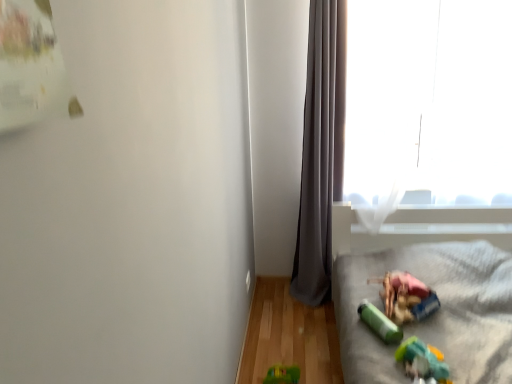
Question: Looking at the image, does transparent glass window at upper right seem bigger or smaller compared to plush gray blanket at lower right?

Choices:
 (A) small
 (B) big

Answer: (A)

Question: In terms of height, does transparent glass window at upper right look taller or shorter compared to plush gray blanket at lower right?

Choices:
 (A) short
 (B) tall

Answer: (B)

Question: Based on their relative distances, which object is nearer to the gray fabric curtain at right?

Choices:
 (A) green plastic toy at lower right
 (B) transparent glass window at upper right
 (C) plastic green toy at lower right, arranged as the 2th toy when viewed from the back
 (D) plush gray blanket at lower right
 (E) green rubber toy at lower right, which appears as the second toy when viewed from the front

Answer: (B)

Question: Which is farther from the gray fabric curtain at right?

Choices:
 (A) green rubber toy at lower right, which appears as the second toy when viewed from the front
 (B) transparent glass window at upper right
 (C) green plastic toy at lower right
 (D) plush gray blanket at lower right
 (E) plastic green toy at lower right, arranged as the 2th toy when viewed from the back

Answer: (E)